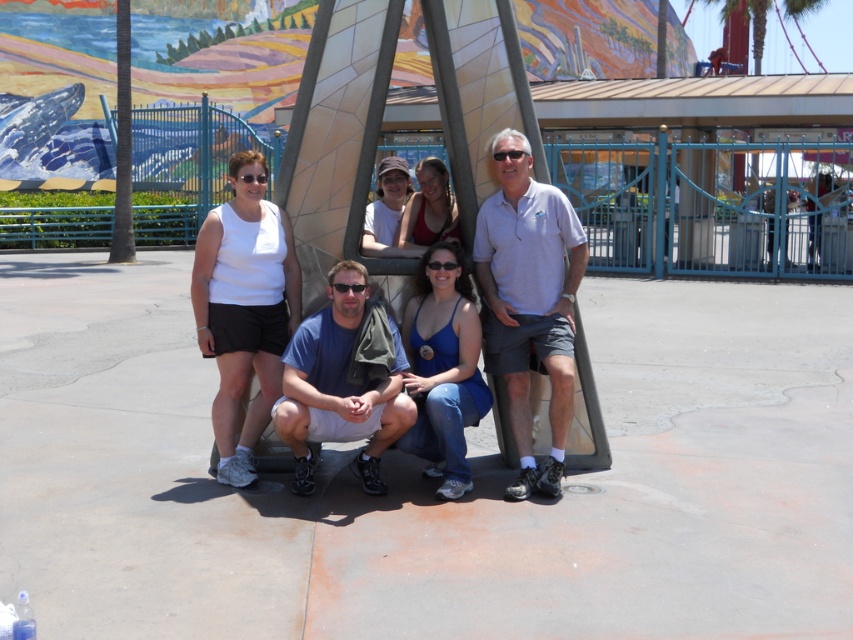
Question: Is matte white tank top at center to the left of gray cotton polo shirt at center from the viewer's perspective?

Choices:
 (A) no
 (B) yes

Answer: (B)

Question: Is gray cotton polo shirt at center to the left of blue fabric shirt at center from the viewer's perspective?

Choices:
 (A) no
 (B) yes

Answer: (A)

Question: Which point is farther to the camera?

Choices:
 (A) matte white tank top at center
 (B) gray cotton polo shirt at center
 (C) blue fabric shirt at center

Answer: (B)

Question: Which point is closer to the camera?

Choices:
 (A) gray cotton polo shirt at center
 (B) matte white shirt at center
 (C) blue fabric shirt at center
 (D) matte white tank top at center

Answer: (C)

Question: Does gray cotton polo shirt at center appear over matte white shirt at center?

Choices:
 (A) no
 (B) yes

Answer: (A)

Question: Which point is closer to the camera?

Choices:
 (A) gray cotton polo shirt at center
 (B) matte white tank top at center
 (C) blue fabric shirt at center
 (D) matte white shirt at center

Answer: (C)